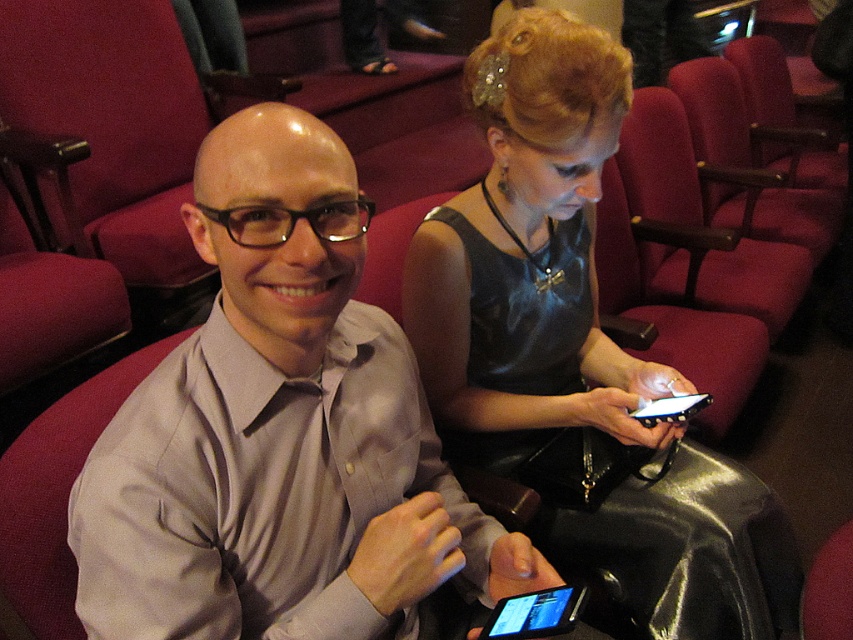
You are an assistant who needs to check if the gray matte shirt at center is covering the black glossy tablet at lower center. Based on the scene, can you confirm this?

The gray matte shirt at center is positioned over black glossy tablet at lower center, so yes, the gray matte shirt at center is covering the black glossy tablet at lower center.

You are attending a theater performance and notice two people sitting in front of you. You see the gray matte shirt at center and the shiny black dress at center. Which clothing item is smaller in size?

The gray matte shirt at center is smaller than the shiny black dress at center.